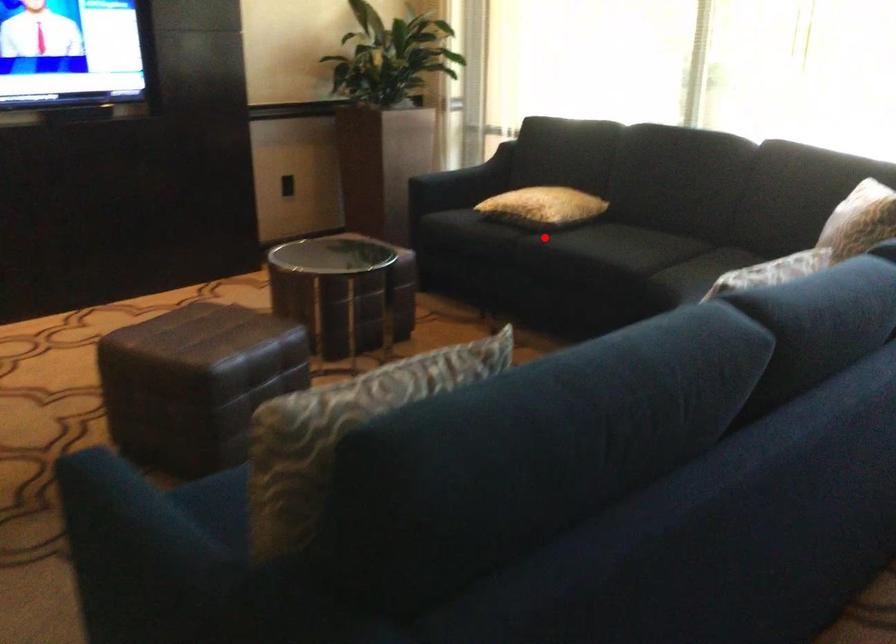
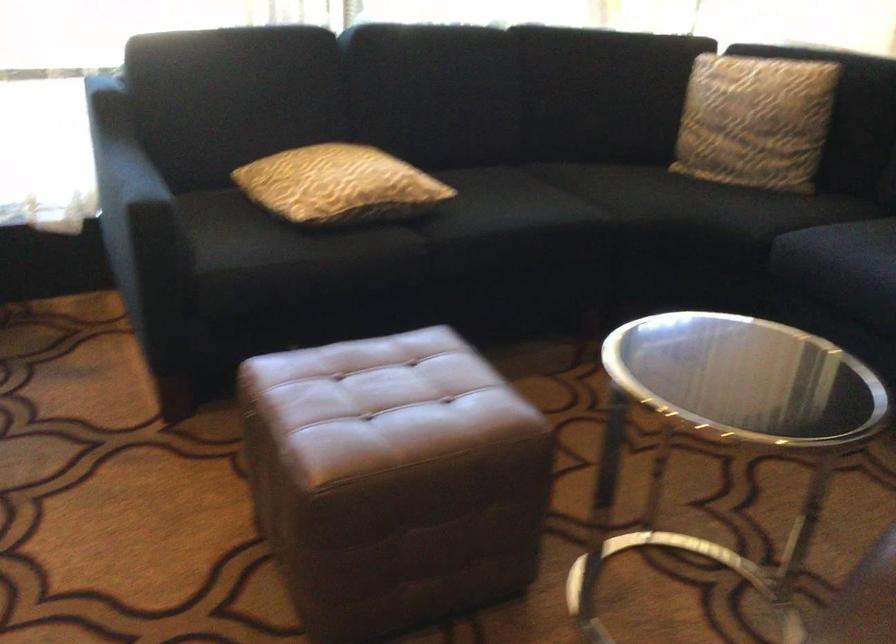
Where in the second image is the point corresponding to the highlighted location from the first image?

(426, 227)